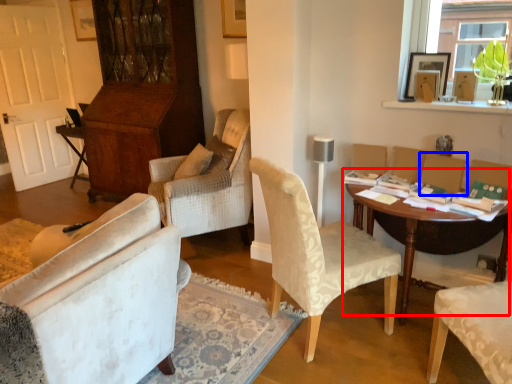
Question: Which of the following is the closest to the observer, table (highlighted by a red box) or armchair (highlighted by a blue box)?

Choices:
 (A) table
 (B) armchair

Answer: (A)